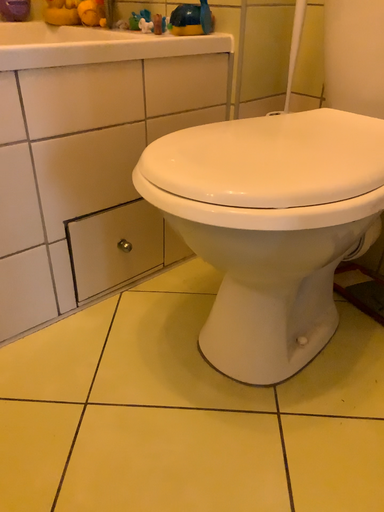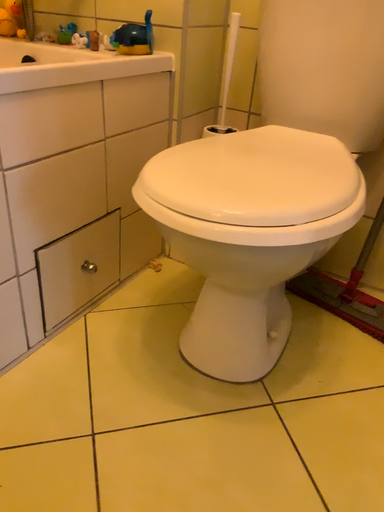
Question: Which way did the camera rotate in the video?

Choices:
 (A) rotated left
 (B) rotated right

Answer: (B)